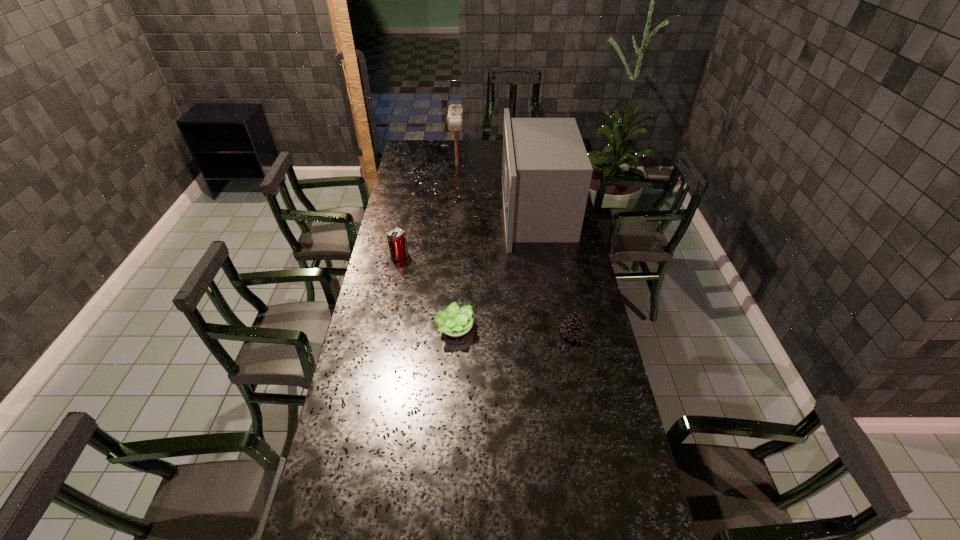
In order to click on unoccupied position between the second shortest object and the third tallest object in this screenshot , I will do `click(486, 295)`.

Select which object is the fourth closest to the pinecone. Please provide its 2D coordinates. Your answer should be formatted as a tuple, i.e. [(x, y)], where the tuple contains the x and y coordinates of a point satisfying the conditions above.

[(455, 112)]

Identify which object is the fourth nearest to the microwave oven. Please provide its 2D coordinates. Your answer should be formatted as a tuple, i.e. [(x, y)], where the tuple contains the x and y coordinates of a point satisfying the conditions above.

[(396, 237)]

This screenshot has height=540, width=960. In order to click on free space that satisfies the following two spatial constraints: 1. on the striking face of the shortest object; 2. on the left side of the mallet in this screenshot , I will do `click(446, 328)`.

Locate an element on the screen. This screenshot has height=540, width=960. free space that satisfies the following two spatial constraints: 1. on the striking face of the mallet; 2. on the left side of the shortest object is located at coordinates (446, 328).